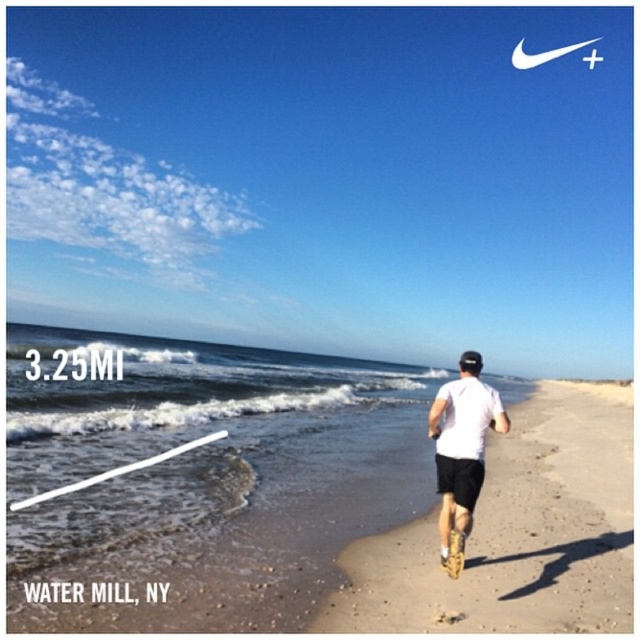
Question: Among these objects, which one is farthest from the camera?

Choices:
 (A) white matte shirt at center
 (B) sandy beach at center

Answer: (A)

Question: Observing the image, what is the correct spatial positioning of sandy beach at center in reference to white matte shirt at center?

Choices:
 (A) right
 (B) left

Answer: (A)

Question: Which point appears closest to the camera in this image?

Choices:
 (A) (436, 408)
 (B) (588, 436)

Answer: (A)

Question: Which of the following is the closest to the observer?

Choices:
 (A) white matte shirt at center
 (B) sandy beach at center

Answer: (B)

Question: Can you confirm if sandy beach at center is positioned above white matte shirt at center?

Choices:
 (A) no
 (B) yes

Answer: (A)

Question: Does sandy beach at center appear on the right side of white matte shirt at center?

Choices:
 (A) yes
 (B) no

Answer: (A)